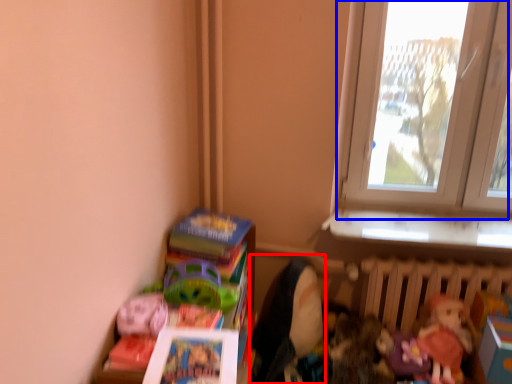
Question: Which object appears farthest to the camera in this image, doll (highlighted by a red box) or window (highlighted by a blue box)?

Choices:
 (A) doll
 (B) window

Answer: (B)